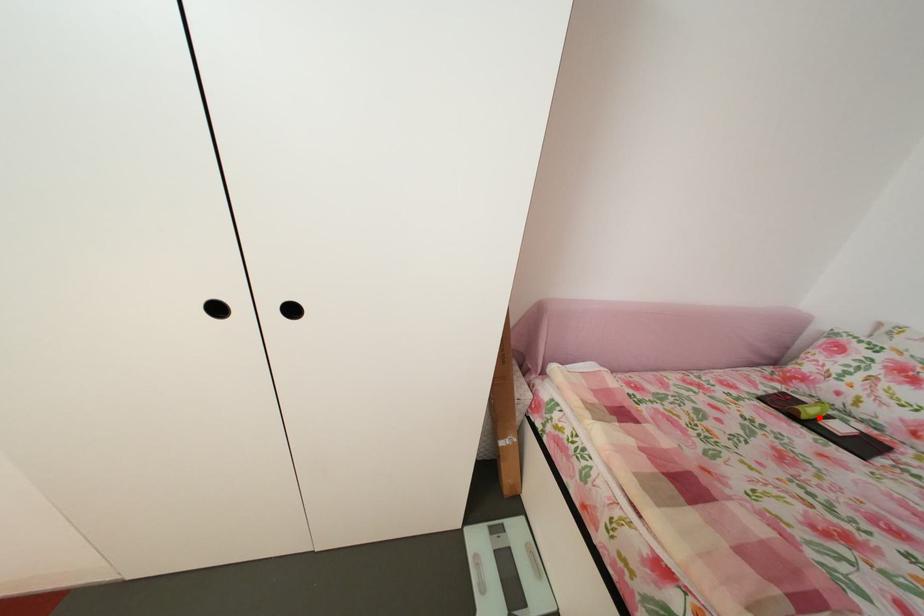
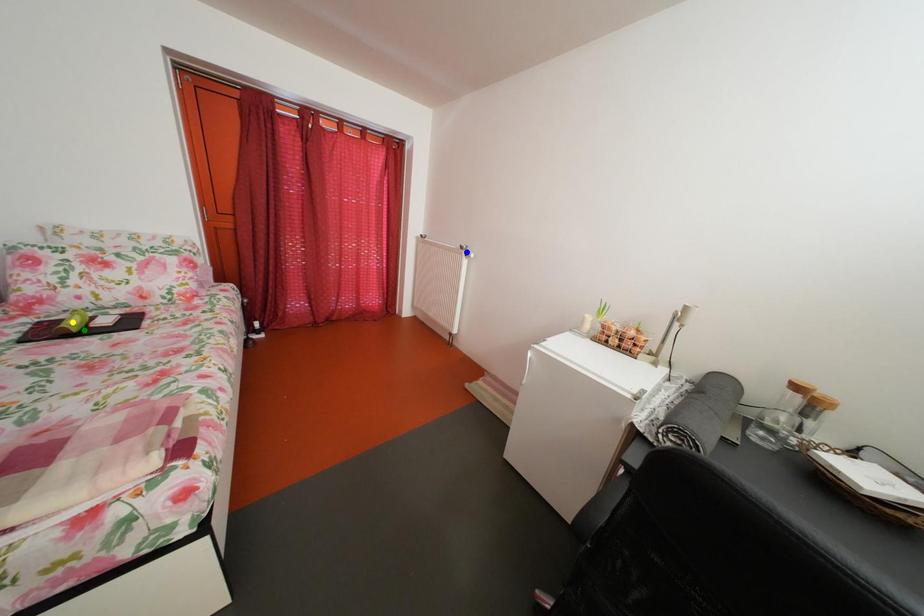
Question: I am providing you with two images of the same scene from different viewpoints. A red point is marked on the first image. You are given multiple points on the second image. Can you choose the point in image 2 that corresponds to the point in image 1?

Choices:
 (A) green point
 (B) yellow point
 (C) blue point

Answer: (A)